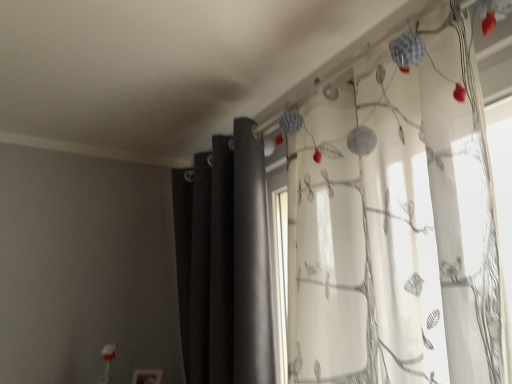
This screenshot has height=384, width=512. I want to click on dark matte curtain at center, marked as the 1th curtain in a left-to-right arrangement, so click(228, 261).

This screenshot has height=384, width=512. What do you see at coordinates (228, 261) in the screenshot? I see `dark matte curtain at center, marked as the 1th curtain in a left-to-right arrangement` at bounding box center [228, 261].

The height and width of the screenshot is (384, 512). Identify the location of white sheer curtain with floral pattern at right, marked as the first curtain in a right-to-left arrangement. (358, 228).

This screenshot has height=384, width=512. What do you see at coordinates (358, 228) in the screenshot?
I see `white sheer curtain with floral pattern at right, which is the second curtain in left-to-right order` at bounding box center [358, 228].

Image resolution: width=512 pixels, height=384 pixels. What are the coordinates of `dark matte curtain at center, which appears as the second curtain when viewed from the right` in the screenshot? It's located at (228, 261).

Visually, is dark matte curtain at center, which appears as the second curtain when viewed from the right, positioned to the left or to the right of white sheer curtain with floral pattern at right, marked as the first curtain in a right-to-left arrangement?

In the image, dark matte curtain at center, which appears as the second curtain when viewed from the right, appears on the left side of white sheer curtain with floral pattern at right, marked as the first curtain in a right-to-left arrangement.

Considering the relative positions of dark matte curtain at center, marked as the 1th curtain in a left-to-right arrangement, and white sheer curtain with floral pattern at right, marked as the first curtain in a right-to-left arrangement, in the image provided, is dark matte curtain at center, marked as the 1th curtain in a left-to-right arrangement, in front of white sheer curtain with floral pattern at right, marked as the first curtain in a right-to-left arrangement,?

No, it is behind white sheer curtain with floral pattern at right, marked as the first curtain in a right-to-left arrangement.

Which point is more distant from viewer, (269, 253) or (498, 269)?

The point (269, 253) is behind.

From the image's perspective, is dark matte curtain at center, marked as the 1th curtain in a left-to-right arrangement, below white sheer curtain with floral pattern at right, which is the second curtain in left-to-right order?

Indeed, from the image's perspective, dark matte curtain at center, marked as the 1th curtain in a left-to-right arrangement, is shown beneath white sheer curtain with floral pattern at right, which is the second curtain in left-to-right order.

From a real-world perspective, between dark matte curtain at center, which appears as the second curtain when viewed from the right, and white sheer curtain with floral pattern at right, marked as the first curtain in a right-to-left arrangement, who is vertically higher?

white sheer curtain with floral pattern at right, marked as the first curtain in a right-to-left arrangement, is physically above.

Does dark matte curtain at center, marked as the 1th curtain in a left-to-right arrangement, have a lesser width compared to white sheer curtain with floral pattern at right, marked as the first curtain in a right-to-left arrangement?

Yes.

In terms of height, does dark matte curtain at center, which appears as the second curtain when viewed from the right, look taller or shorter compared to white sheer curtain with floral pattern at right, marked as the first curtain in a right-to-left arrangement?

In the image, dark matte curtain at center, which appears as the second curtain when viewed from the right, appears to be taller than white sheer curtain with floral pattern at right, marked as the first curtain in a right-to-left arrangement.

Is dark matte curtain at center, which appears as the second curtain when viewed from the right, bigger than white sheer curtain with floral pattern at right, which is the second curtain in left-to-right order?

Correct, dark matte curtain at center, which appears as the second curtain when viewed from the right, is larger in size than white sheer curtain with floral pattern at right, which is the second curtain in left-to-right order.

Is dark matte curtain at center, marked as the 1th curtain in a left-to-right arrangement, completely or partially outside of white sheer curtain with floral pattern at right, which is the second curtain in left-to-right order?

Absolutely, dark matte curtain at center, marked as the 1th curtain in a left-to-right arrangement, is external to white sheer curtain with floral pattern at right, which is the second curtain in left-to-right order.

Are dark matte curtain at center, which appears as the second curtain when viewed from the right, and white sheer curtain with floral pattern at right, marked as the first curtain in a right-to-left arrangement, far apart?

No, dark matte curtain at center, which appears as the second curtain when viewed from the right, is not far from white sheer curtain with floral pattern at right, marked as the first curtain in a right-to-left arrangement.

Is dark matte curtain at center, which appears as the second curtain when viewed from the right, facing away from white sheer curtain with floral pattern at right, marked as the first curtain in a right-to-left arrangement?

dark matte curtain at center, which appears as the second curtain when viewed from the right, does not have its back to white sheer curtain with floral pattern at right, marked as the first curtain in a right-to-left arrangement.

How many degrees apart are the facing directions of dark matte curtain at center, which appears as the second curtain when viewed from the right, and white sheer curtain with floral pattern at right, which is the second curtain in left-to-right order?

0.000215 degrees separate the facing orientations of dark matte curtain at center, which appears as the second curtain when viewed from the right, and white sheer curtain with floral pattern at right, which is the second curtain in left-to-right order.

The width and height of the screenshot is (512, 384). I want to click on curtain in front of the dark matte curtain at center, marked as the 1th curtain in a left-to-right arrangement, so click(x=358, y=228).

Is white sheer curtain with floral pattern at right, marked as the first curtain in a right-to-left arrangement, to the left of dark matte curtain at center, marked as the 1th curtain in a left-to-right arrangement, from the viewer's perspective?

No, white sheer curtain with floral pattern at right, marked as the first curtain in a right-to-left arrangement, is not to the left of dark matte curtain at center, marked as the 1th curtain in a left-to-right arrangement.

Relative to dark matte curtain at center, which appears as the second curtain when viewed from the right, is white sheer curtain with floral pattern at right, marked as the first curtain in a right-to-left arrangement, in front or behind?

Visually, white sheer curtain with floral pattern at right, marked as the first curtain in a right-to-left arrangement, is located in front of dark matte curtain at center, which appears as the second curtain when viewed from the right.

Which is closer to the camera, (417, 141) or (225, 366)?

The point (417, 141) is in front.

From the image's perspective, which object appears higher, white sheer curtain with floral pattern at right, marked as the first curtain in a right-to-left arrangement, or dark matte curtain at center, which appears as the second curtain when viewed from the right?

white sheer curtain with floral pattern at right, marked as the first curtain in a right-to-left arrangement, from the image's perspective.

From a real-world perspective, which object stands above the other?

white sheer curtain with floral pattern at right, marked as the first curtain in a right-to-left arrangement, is physically above.

Considering the sizes of objects white sheer curtain with floral pattern at right, marked as the first curtain in a right-to-left arrangement, and dark matte curtain at center, marked as the 1th curtain in a left-to-right arrangement, in the image provided, who is wider, white sheer curtain with floral pattern at right, marked as the first curtain in a right-to-left arrangement, or dark matte curtain at center, marked as the 1th curtain in a left-to-right arrangement,?

white sheer curtain with floral pattern at right, marked as the first curtain in a right-to-left arrangement, is wider.

Considering the sizes of objects white sheer curtain with floral pattern at right, marked as the first curtain in a right-to-left arrangement, and dark matte curtain at center, marked as the 1th curtain in a left-to-right arrangement, in the image provided, who is shorter, white sheer curtain with floral pattern at right, marked as the first curtain in a right-to-left arrangement, or dark matte curtain at center, marked as the 1th curtain in a left-to-right arrangement,?

white sheer curtain with floral pattern at right, marked as the first curtain in a right-to-left arrangement, is shorter.

Who is smaller, white sheer curtain with floral pattern at right, which is the second curtain in left-to-right order, or dark matte curtain at center, which appears as the second curtain when viewed from the right?

With smaller size is white sheer curtain with floral pattern at right, which is the second curtain in left-to-right order.

Is white sheer curtain with floral pattern at right, which is the second curtain in left-to-right order, not inside dark matte curtain at center, which appears as the second curtain when viewed from the right?

white sheer curtain with floral pattern at right, which is the second curtain in left-to-right order, is positioned outside dark matte curtain at center, which appears as the second curtain when viewed from the right.

Is white sheer curtain with floral pattern at right, which is the second curtain in left-to-right order, not near dark matte curtain at center, marked as the 1th curtain in a left-to-right arrangement?

They are positioned close to each other.

Is white sheer curtain with floral pattern at right, marked as the first curtain in a right-to-left arrangement, oriented away from dark matte curtain at center, marked as the 1th curtain in a left-to-right arrangement?

No, white sheer curtain with floral pattern at right, marked as the first curtain in a right-to-left arrangement,'s orientation is not away from dark matte curtain at center, marked as the 1th curtain in a left-to-right arrangement.

There is a dark matte curtain at center, marked as the 1th curtain in a left-to-right arrangement. At what (x,y) coordinates should I click in order to perform the action: click on curtain above it (from a real-world perspective). Please return your answer as a coordinate pair (x, y). The width and height of the screenshot is (512, 384). Looking at the image, I should click on click(358, 228).

Identify the location of curtain located in front of the dark matte curtain at center, which appears as the second curtain when viewed from the right. The width and height of the screenshot is (512, 384). (358, 228).

Where is `curtain on the right of dark matte curtain at center, marked as the 1th curtain in a left-to-right arrangement`? The width and height of the screenshot is (512, 384). curtain on the right of dark matte curtain at center, marked as the 1th curtain in a left-to-right arrangement is located at coordinates [358, 228].